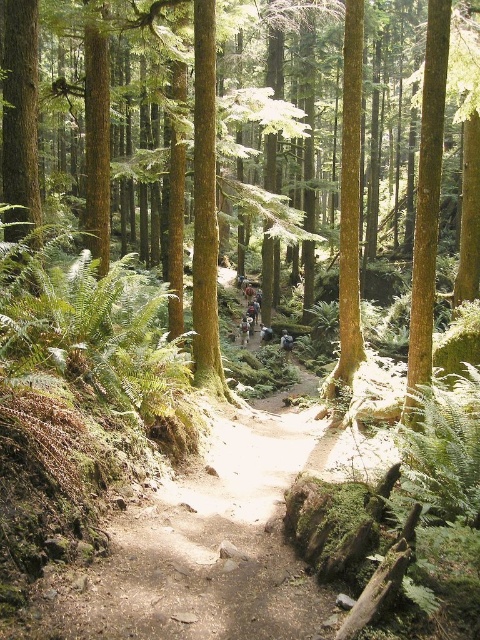
Consider the image. You are a hiker standing at the center of the forest trail. You notice the green leafy fern at left. Based on its position, which direction should you turn to look at it?

The green leafy fern at left is located at point 0.514 on the x axis and 0.190 on the y axis. Since the x coordinate is greater than 0.5, it means it is to the right side of the image. However, the object label says it is at left. This discrepancy suggests an error in the coordinate system. Assuming the coordinate system places (0, 0) at the bottom left corner, then the x value of 0.514 would place it slightly to the right of center. But the object label says it is at left. To resolve this, perhaps the y axis

You are a hiker on a narrow forest trail. You notice a green leafy fern at left and a green rough bark tree at center. Which object would cast a shorter shadow during midday?

The green leafy fern at left is smaller than the green rough bark tree at center, so it would cast a shorter shadow during midday.